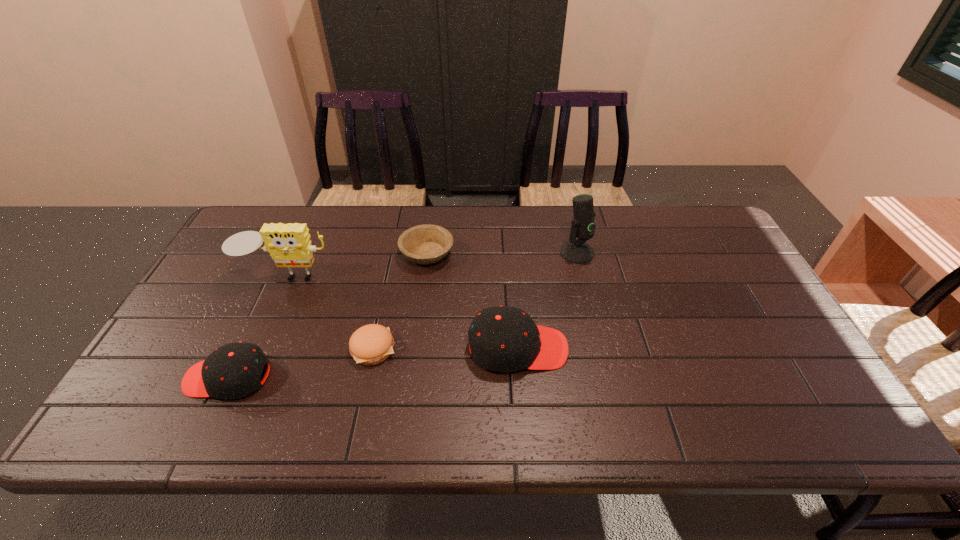
This screenshot has height=540, width=960. Identify the location of the shorter cap. (232, 371).

What are the coordinates of `the left cap` in the screenshot? It's located at (232, 371).

Identify the location of the taller cap. The width and height of the screenshot is (960, 540). (501, 339).

Identify the location of the third tallest object. (501, 339).

Identify the location of microphone. The image size is (960, 540). (575, 251).

Where is `sponge`? The width and height of the screenshot is (960, 540). sponge is located at coordinates (289, 245).

Locate an element on the screen. bowl is located at coordinates (424, 244).

Where is `patty`? patty is located at coordinates (371, 344).

In order to click on vacant space located 0.100m on the front-facing side of the shorter cap in this screenshot , I will do `click(144, 377)`.

This screenshot has height=540, width=960. In order to click on vacant space located on the front-facing side of the fourth shortest object in this screenshot , I will do `click(612, 348)`.